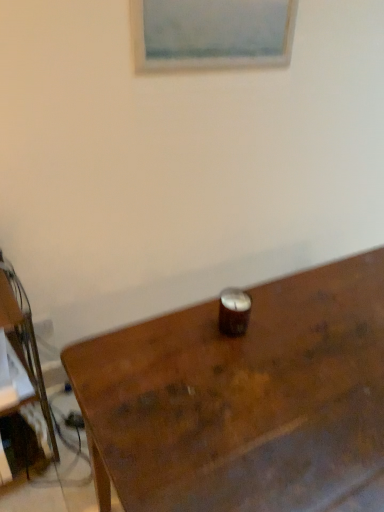
This screenshot has height=512, width=384. Find the location of `free space above wooden table at center (from a real-world perspective)`. free space above wooden table at center (from a real-world perspective) is located at coordinates (279, 350).